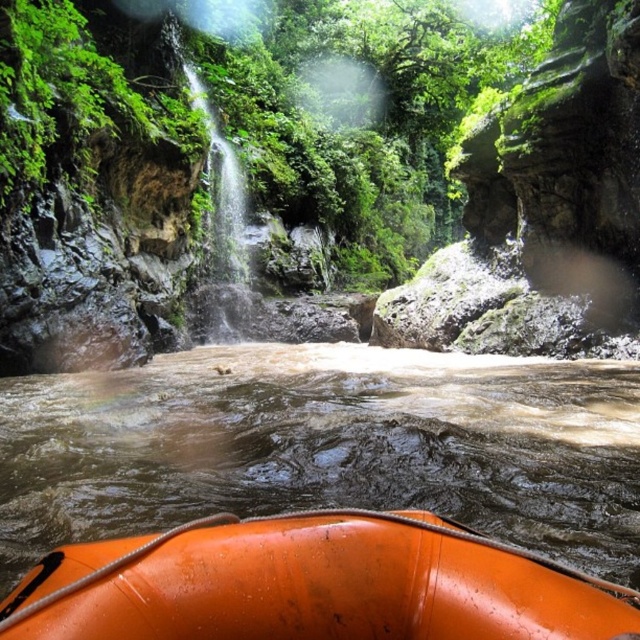
Can you confirm if orange rubber raft at lower center is thinner than orange rubber boat at lower center?

In fact, orange rubber raft at lower center might be wider than orange rubber boat at lower center.

Does orange rubber raft at lower center appear under orange rubber boat at lower center?

Yes, orange rubber raft at lower center is below orange rubber boat at lower center.

Between point (106, 461) and point (80, 552), which one is positioned in front?

Point (80, 552) is more forward.

At what (x,y) coordinates should I click in order to perform the action: click on orange rubber raft at lower center. Please return your answer as a coordinate pair (x, y). This screenshot has width=640, height=640. Looking at the image, I should click on (310, 586).